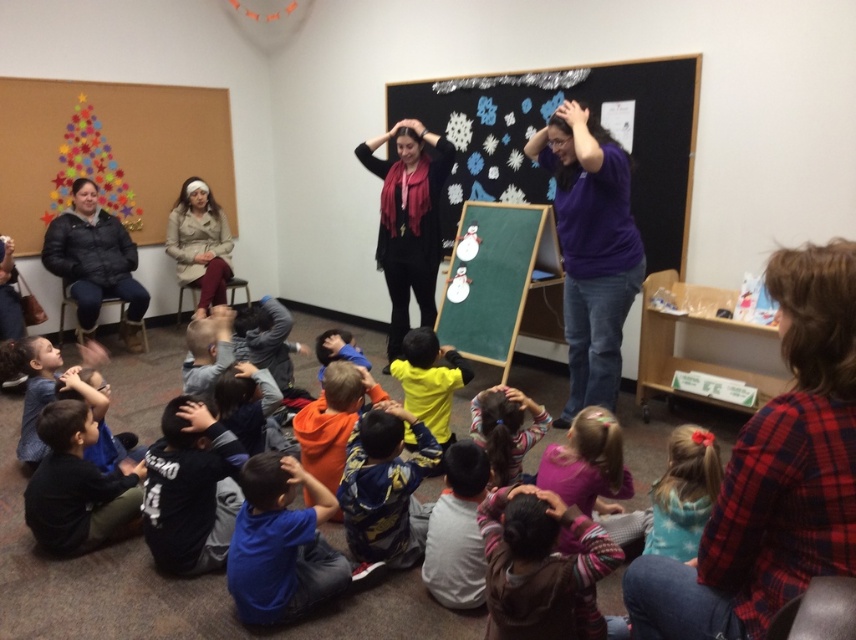
Question: Does purple cotton shirt at center appear under striped sweater at center?

Choices:
 (A) no
 (B) yes

Answer: (A)

Question: Which point is farther to the camera?

Choices:
 (A) (418, 134)
 (B) (435, 122)
 (C) (51, 413)
 (D) (550, 115)

Answer: (B)

Question: Among these points, which one is farthest from the camera?

Choices:
 (A) (504, 589)
 (B) (183, 260)

Answer: (B)

Question: Which of the following is the farthest from the observer?

Choices:
 (A) (434, 276)
 (B) (609, 228)
 (C) (840, 422)

Answer: (A)

Question: In this image, where is plaid flannel shirt at lower right located relative to striped sweater at center?

Choices:
 (A) above
 (B) below

Answer: (A)

Question: Can you confirm if purple cotton shirt at center is positioned above striped sweater at center?

Choices:
 (A) no
 (B) yes

Answer: (B)